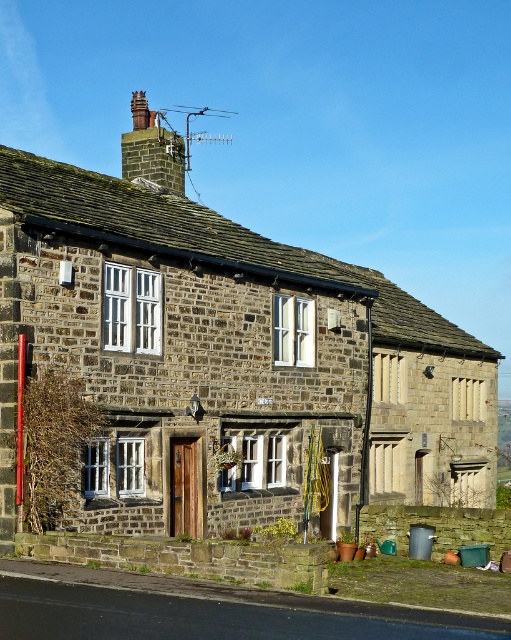
Question: Among these objects, which one is nearest to the camera?

Choices:
 (A) rusty metal chimney at upper center
 (B) stone cottage at center

Answer: (B)

Question: Can you confirm if stone cottage at center is bigger than rusty metal chimney at upper center?

Choices:
 (A) no
 (B) yes

Answer: (A)

Question: Which object is closer to the camera taking this photo?

Choices:
 (A) rusty metal chimney at upper center
 (B) stone cottage at center

Answer: (B)

Question: Can you confirm if stone cottage at center is smaller than rusty metal chimney at upper center?

Choices:
 (A) yes
 (B) no

Answer: (A)

Question: Where is stone cottage at center located in relation to rusty metal chimney at upper center in the image?

Choices:
 (A) left
 (B) right

Answer: (B)